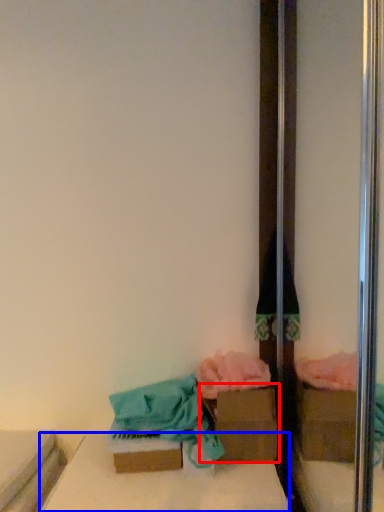
Question: Which object appears closest to the camera in this image, cardboard box (highlighted by a red box) or furniture (highlighted by a blue box)?

Choices:
 (A) cardboard box
 (B) furniture

Answer: (B)